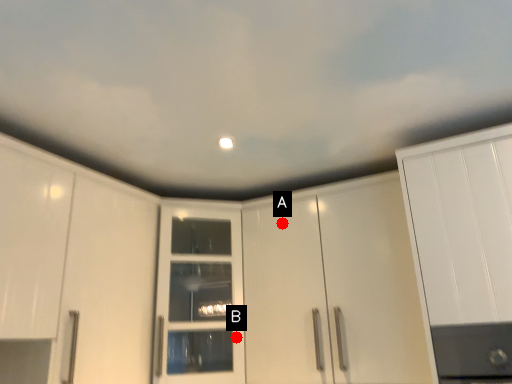
Question: Two points are circled on the image, labeled by A and B beside each circle. Which point is further to the camera?

Choices:
 (A) A is further
 (B) B is further

Answer: (A)